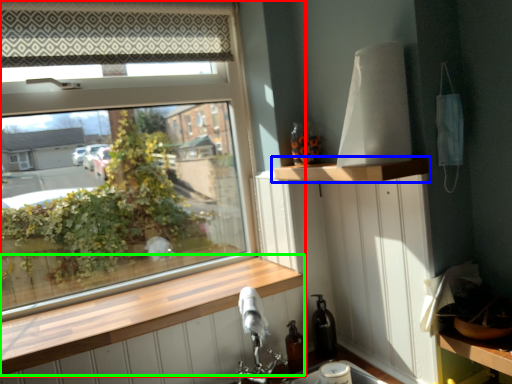
Question: Estimate the real-world distances between objects in this image. Which object is closer to window (highlighted by a red box), shelf (highlighted by a blue box) or window sill (highlighted by a green box)?

Choices:
 (A) shelf
 (B) window sill

Answer: (B)